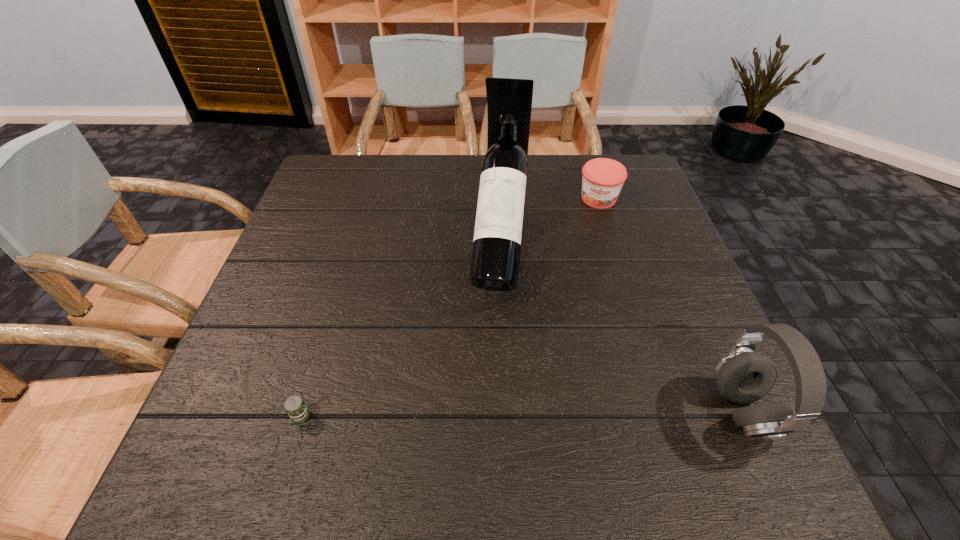
In order to click on headset located at the right edge in this screenshot , I will do `click(743, 376)`.

The image size is (960, 540). What are the coordinates of `jam that is at the right edge` in the screenshot? It's located at (602, 180).

Locate an element on the screen. object located at the near left corner is located at coordinates (295, 407).

This screenshot has width=960, height=540. I want to click on object that is positioned at the far right corner, so click(602, 180).

You are a GUI agent. You are given a task and a screenshot of the screen. Output one action in this format:
    pyautogui.click(x=<x>, y=<y>)
    Task: Click on the object at the near right corner
    The height and width of the screenshot is (540, 960).
    Given the screenshot: What is the action you would take?
    pyautogui.click(x=743, y=376)

What are the coordinates of `vacant space at the far edge of the desktop` in the screenshot? It's located at (562, 176).

This screenshot has height=540, width=960. Identify the location of vacant space at the left edge of the desktop. (258, 307).

In the image, there is a desktop. Where is `free region at the right edge`? This screenshot has width=960, height=540. free region at the right edge is located at coordinates (685, 260).

This screenshot has height=540, width=960. What are the coordinates of `free region at the far left corner of the desktop` in the screenshot? It's located at (309, 195).

The image size is (960, 540). What are the coordinates of `vacant space at the far right corner of the desktop` in the screenshot? It's located at (628, 156).